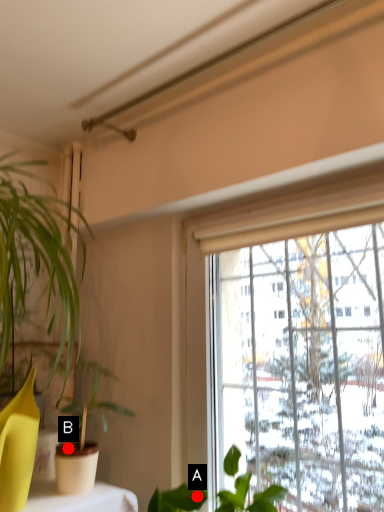
Question: Two points are circled on the image, labeled by A and B beside each circle. Which point is farther from the camera taking this photo?

Choices:
 (A) A is further
 (B) B is further

Answer: (B)